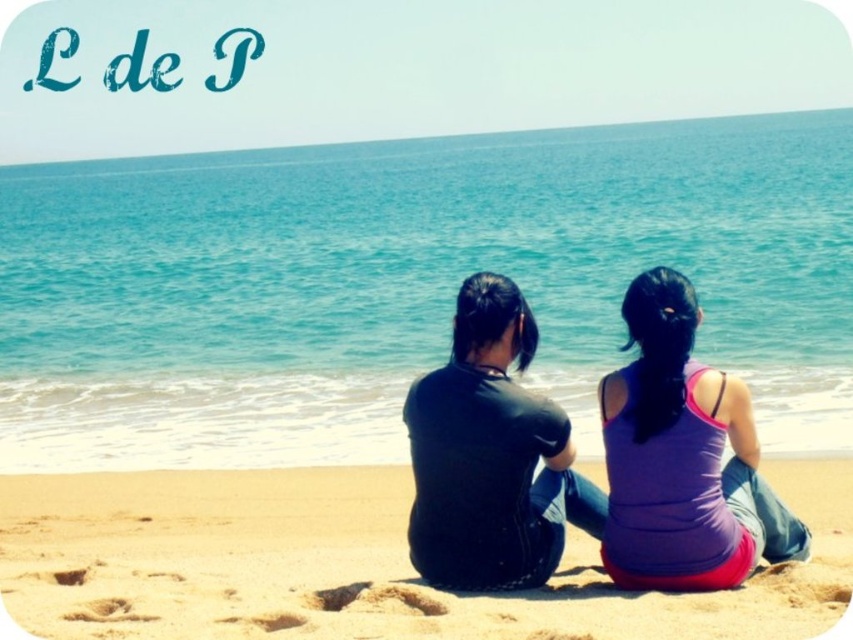
You are a photographer trying to capture a wide shot of the beach scene. You need to ensure that both the sandy yellow sand at center and the black matte shirt at center are fully visible in the frame. Based on their widths, which object might require you to adjust your camera angle to include it properly?

The sandy yellow sand at center might be wider than the black matte shirt at center, so you might need to adjust your camera angle to ensure the wider sandy yellow sand at center fits entirely within the frame.

Looking at this image, you are standing on the beach and want to take a photo of the black matte shirt at center without including the sandy yellow sand at center in the frame. How should you position your camera?

To exclude the sandy yellow sand at center from the photo while capturing the black matte shirt at center, position the camera behind the black matte shirt at center so that it blocks the view of the sandy yellow sand at center.